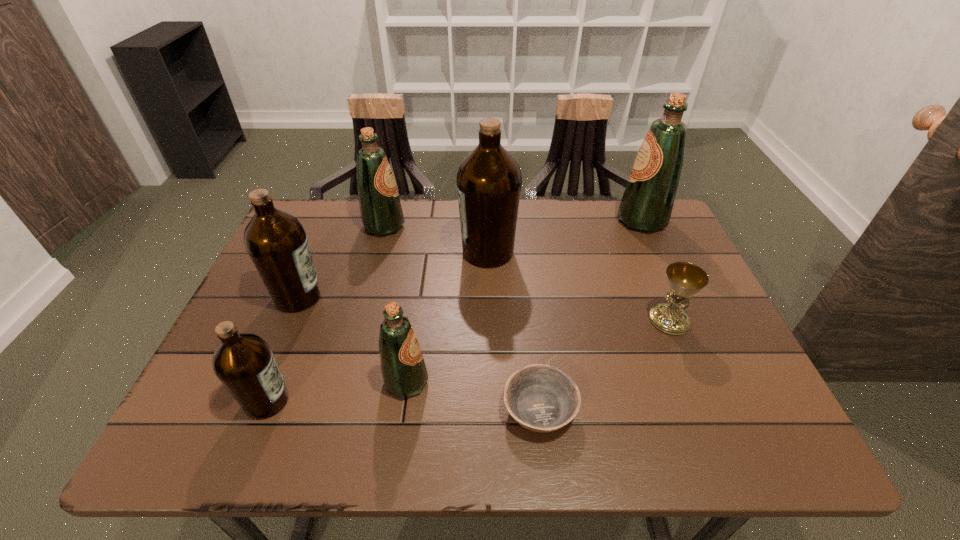
Identify the location of free space located on the label of the fourth farthest olive oil. This screenshot has height=540, width=960. (468, 297).

At what (x,y) coordinates should I click in order to perform the action: click on blank space located on the front-facing side of the second green olive oil from right to left. Please return your answer as a coordinate pair (x, y). Looking at the image, I should click on (583, 381).

In order to click on vacant space located 0.100m on the label of the smallest brown olive oil in this screenshot , I will do `click(341, 401)`.

This screenshot has width=960, height=540. Find the location of `vacant space located on the front of the second shortest object`. vacant space located on the front of the second shortest object is located at coordinates (698, 389).

You are a GUI agent. You are given a task and a screenshot of the screen. Output one action in this format:
    pyautogui.click(x=<x>, y=<y>)
    Task: Click on the vacant space situated on the right of the bowl
    The height and width of the screenshot is (540, 960).
    Given the screenshot: What is the action you would take?
    point(602,409)

The image size is (960, 540). Identify the location of olive oil that is at the near edge. (244, 363).

I want to click on bowl present at the near edge, so click(x=541, y=398).

Identify the location of olive oil that is at the right edge. (647, 202).

The height and width of the screenshot is (540, 960). What are the coordinates of `chalice that is positioned at the right edge` in the screenshot? It's located at (685, 279).

The height and width of the screenshot is (540, 960). I want to click on object positioned at the near left corner, so click(x=244, y=363).